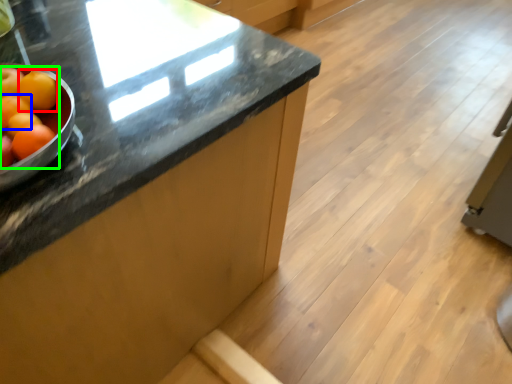
Question: Which object is positioned farthest from tangerine (highlighted by a red box)? Select from orange (highlighted by a blue box) and grapefruit (highlighted by a green box).

Choices:
 (A) orange
 (B) grapefruit

Answer: (A)